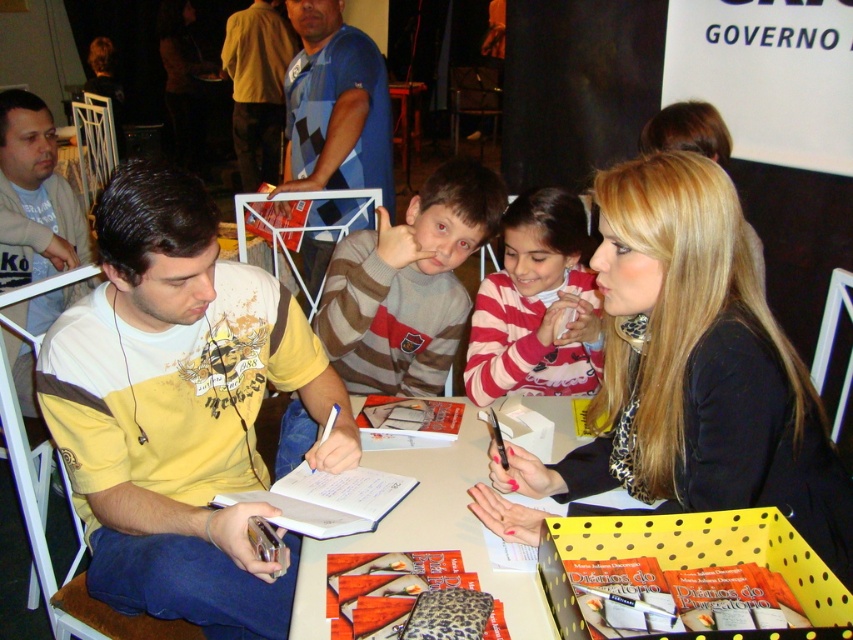
In the scene shown: Can you confirm if blue checkered shirt at upper center is smaller than blue striped shirt at upper center?

Correct, blue checkered shirt at upper center occupies less space than blue striped shirt at upper center.

Which is in front, point (378, 131) or point (273, 8)?

Point (378, 131) is in front.

Identify the location of blue checkered shirt at upper center. This screenshot has height=640, width=853. (335, 106).

Which is in front, point (280, 88) or point (445, 506)?

Positioned in front is point (445, 506).

Which is behind, point (260, 173) or point (560, 440)?

The point (260, 173) is more distant.

Where is `blue striped shirt at upper center`? The width and height of the screenshot is (853, 640). blue striped shirt at upper center is located at coordinates (257, 88).

Is the position of striped cotton shirt at center less distant than that of blue striped shirt at upper center?

Yes, it is in front of blue striped shirt at upper center.

Who is lower down, striped cotton shirt at center or blue striped shirt at upper center?

striped cotton shirt at center is below.

Describe the element at coordinates (537, 305) in the screenshot. The width and height of the screenshot is (853, 640). I see `striped cotton shirt at center` at that location.

Find the location of a particular element. striped cotton shirt at center is located at coordinates (537, 305).